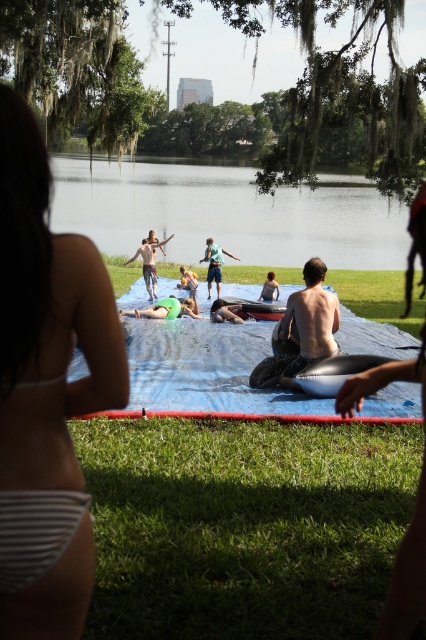
Is point (144, 266) more distant than point (233, 259)?

No, (144, 266) is in front of (233, 259).

Who is taller, tan skin human at center or light blue fabric at center?

Standing taller between the two is tan skin human at center.

At what (x,y) coordinates should I click in order to perform the action: click on tan skin human at center. Please return your answer as a coordinate pair (x, y). This screenshot has width=426, height=640. Looking at the image, I should click on (147, 264).

Find the location of a particular element. This screenshot has height=640, width=426. tan skin human at center is located at coordinates (147, 264).

Can you confirm if clear blue water at center is shorter than blue tarp at center?

No.

Who is shorter, clear blue water at center or blue tarp at center?

Standing shorter between the two is blue tarp at center.

Is point (354, 241) behind point (279, 412)?

Yes, point (354, 241) is farther from viewer.

You are a GUI agent. You are given a task and a screenshot of the screen. Output one action in this format:
    pyautogui.click(x=<x>, y=<y>)
    Task: Click on the clear blue water at center
    The image size is (426, 640).
    Given the screenshot: What is the action you would take?
    pyautogui.click(x=227, y=212)

Can you confirm if blue tarp at center is positioned above tan skin human at center?

No, blue tarp at center is not above tan skin human at center.

Between point (276, 401) and point (146, 252), which one is positioned behind?

The point (146, 252) is more distant.

This screenshot has width=426, height=640. What are the coordinates of `blue tarp at center` in the screenshot? It's located at click(x=207, y=372).